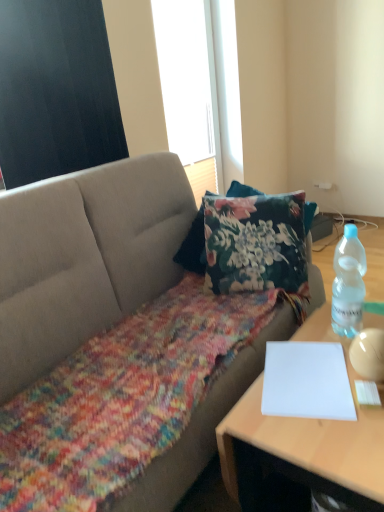
Question: Considering the relative sizes of black matte window screen at upper left, which is the 2th window screen from right to left, and white paper at right in the image provided, is black matte window screen at upper left, which is the 2th window screen from right to left, wider than white paper at right?

Choices:
 (A) yes
 (B) no

Answer: (B)

Question: Is black matte window screen at upper left, which is the second window screen from back to front, oriented away from white paper at right?

Choices:
 (A) no
 (B) yes

Answer: (A)

Question: Considering the relative sizes of black matte window screen at upper left, which is the second window screen from back to front, and white paper at right in the image provided, is black matte window screen at upper left, which is the second window screen from back to front, taller than white paper at right?

Choices:
 (A) yes
 (B) no

Answer: (A)

Question: From a real-world perspective, is black matte window screen at upper left, which is the 2th window screen from right to left, physically below white paper at right?

Choices:
 (A) yes
 (B) no

Answer: (B)

Question: Is black matte window screen at upper left, which is the first window screen in front-to-back order, positioned beyond the bounds of white paper at right?

Choices:
 (A) no
 (B) yes

Answer: (B)

Question: Can you confirm if black matte window screen at upper left, which is the first window screen in front-to-back order, is shorter than white paper at right?

Choices:
 (A) no
 (B) yes

Answer: (A)

Question: From a real-world perspective, does white paper at lower right sit lower than black matte window screen at upper left, which is the 2th window screen from right to left?

Choices:
 (A) no
 (B) yes

Answer: (B)

Question: Can you confirm if white paper at lower right is bigger than black matte window screen at upper left, which is the 2th window screen from right to left?

Choices:
 (A) no
 (B) yes

Answer: (A)

Question: Is white paper at lower right positioned with its back to black matte window screen at upper left, which is the 2th window screen from right to left?

Choices:
 (A) no
 (B) yes

Answer: (A)

Question: From the image's perspective, is white paper at lower right located above black matte window screen at upper left, which is the first window screen in front-to-back order?

Choices:
 (A) no
 (B) yes

Answer: (A)

Question: Is white paper at lower right touching black matte window screen at upper left, arranged as the 1th window screen when viewed from the left?

Choices:
 (A) no
 (B) yes

Answer: (A)

Question: Can we say white paper at lower right lies outside black matte window screen at upper left, arranged as the 1th window screen when viewed from the left?

Choices:
 (A) yes
 (B) no

Answer: (A)

Question: Is clear plastic bottle at right facing towards white paper at lower right?

Choices:
 (A) no
 (B) yes

Answer: (A)